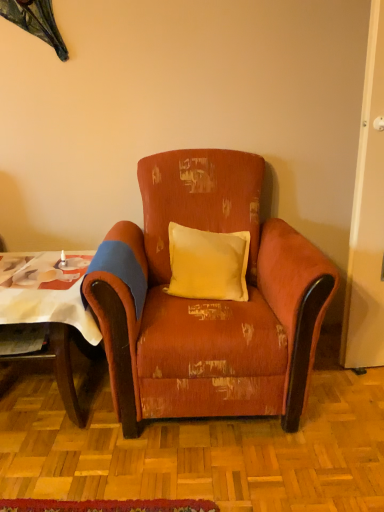
Question: Relative to wooden table at left, is distressed orange fabric armchair at center in front or behind?

Choices:
 (A) behind
 (B) front

Answer: (B)

Question: Looking at the image, does distressed orange fabric armchair at center seem bigger or smaller compared to wooden table at left?

Choices:
 (A) big
 (B) small

Answer: (A)

Question: Estimate the real-world distances between objects in this image. Which object is farther from the distressed orange fabric armchair at center?

Choices:
 (A) yellow fabric pillow at center
 (B) wooden table at left

Answer: (B)

Question: Which object is the closest to the yellow fabric pillow at center?

Choices:
 (A) distressed orange fabric armchair at center
 (B) wooden table at left

Answer: (A)